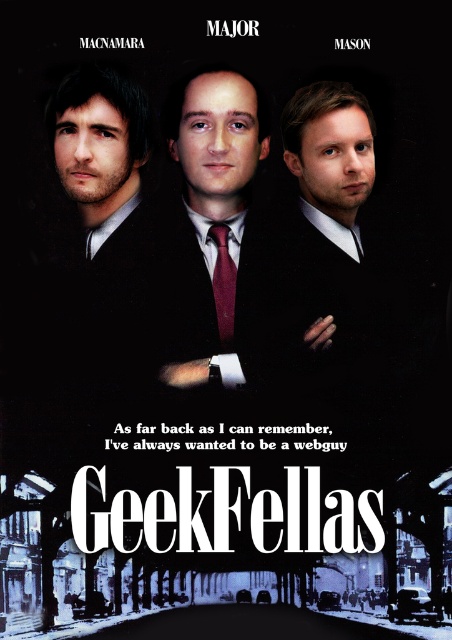
Question: Is matte black suit at center to the left of maroon satin tie at center from the viewer's perspective?

Choices:
 (A) yes
 (B) no

Answer: (A)

Question: In this image, where is matte black suit at center located relative to maroon satin tie at center?

Choices:
 (A) right
 (B) left

Answer: (B)

Question: Does matte black suit at center have a smaller size compared to maroon satin tie at center?

Choices:
 (A) no
 (B) yes

Answer: (A)